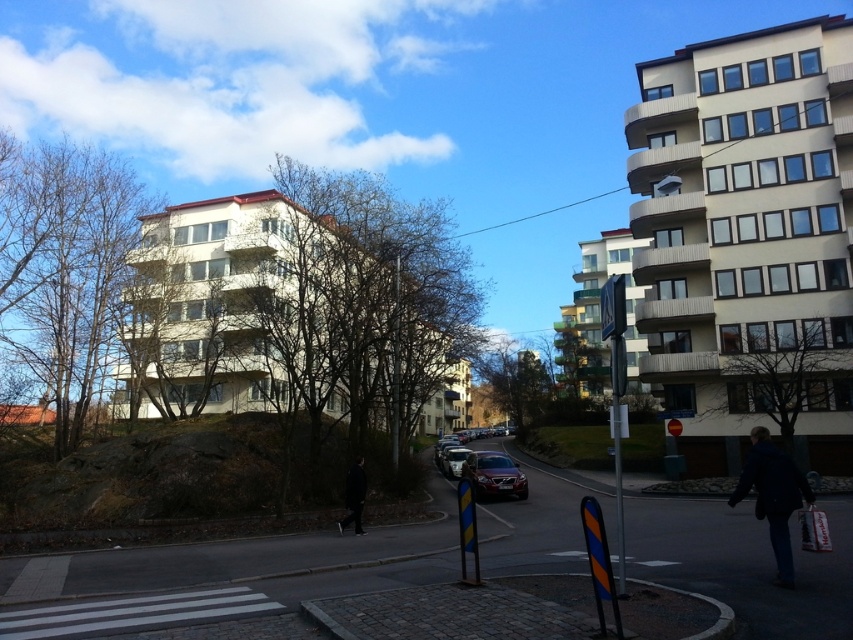
Looking at this image, you are standing on the street and want to take a photo of both point (790, 566) and point (476, 480). Which point should you focus on first to ensure both are in sharp focus?

You should focus on point (790, 566) first because it is closer to the camera than point (476, 480). By focusing on the closer point, the farther point may still be within the depth of field, ensuring both are in focus.

You are a delivery person standing on the street looking at the dark blue jacket at lower right and the reflective silver sign at center. Which object is closer to the left side of the street?

The dark blue jacket at lower right is to the left of the reflective silver sign at center, so it is closer to the left side of the street.